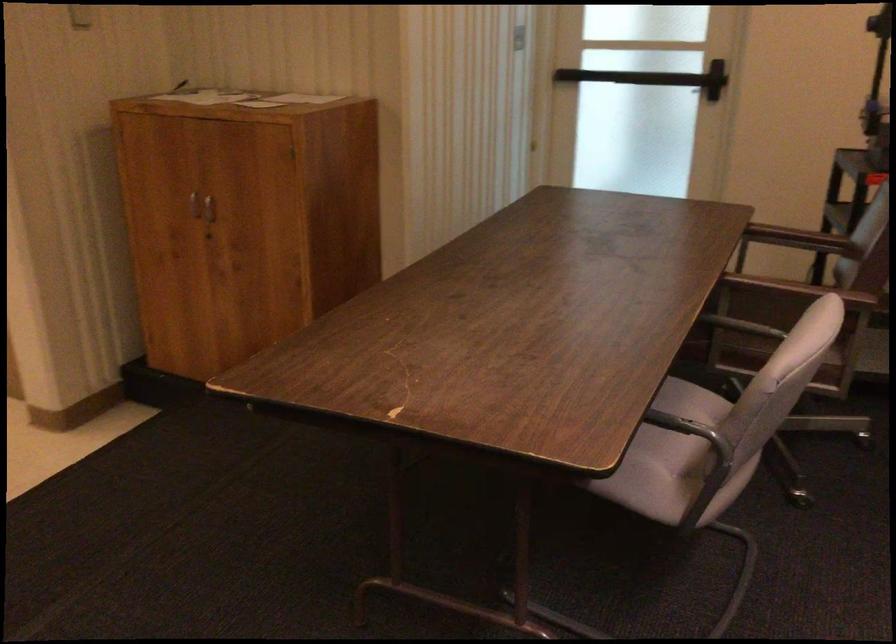
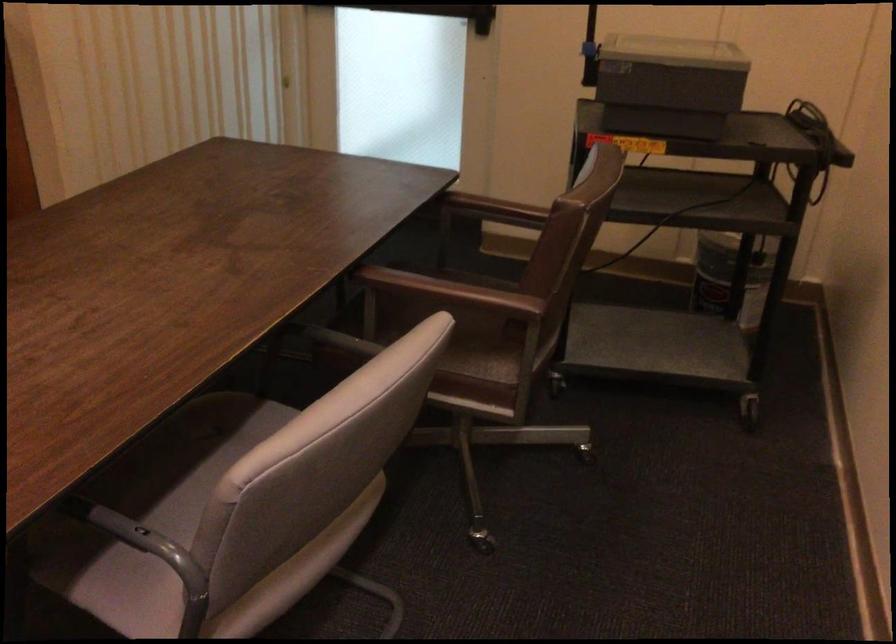
Locate, in the second image, the point that corresponds to point (755, 299) in the first image.

(460, 289)